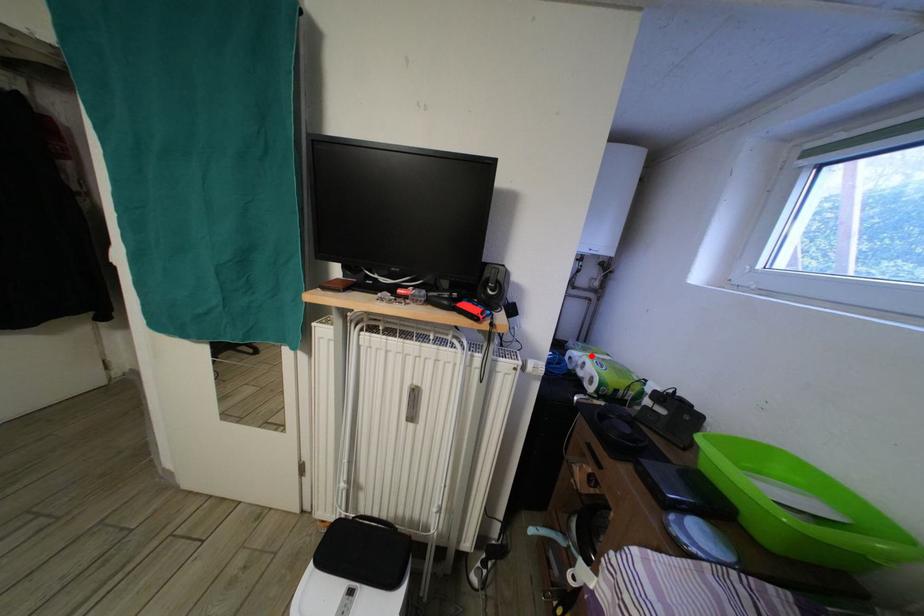
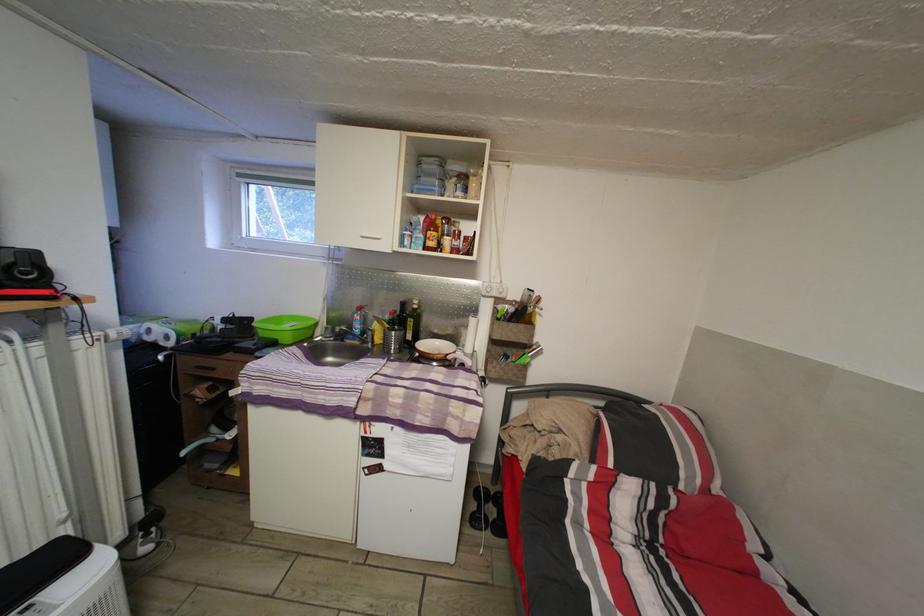
The point at the highlighted location is marked in the first image. Where is the corresponding point in the second image?

(144, 328)